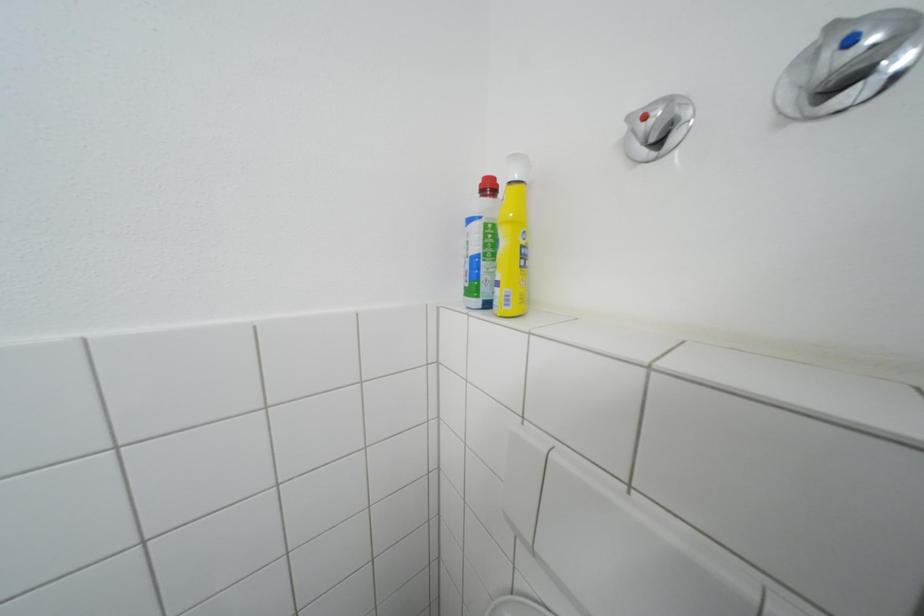
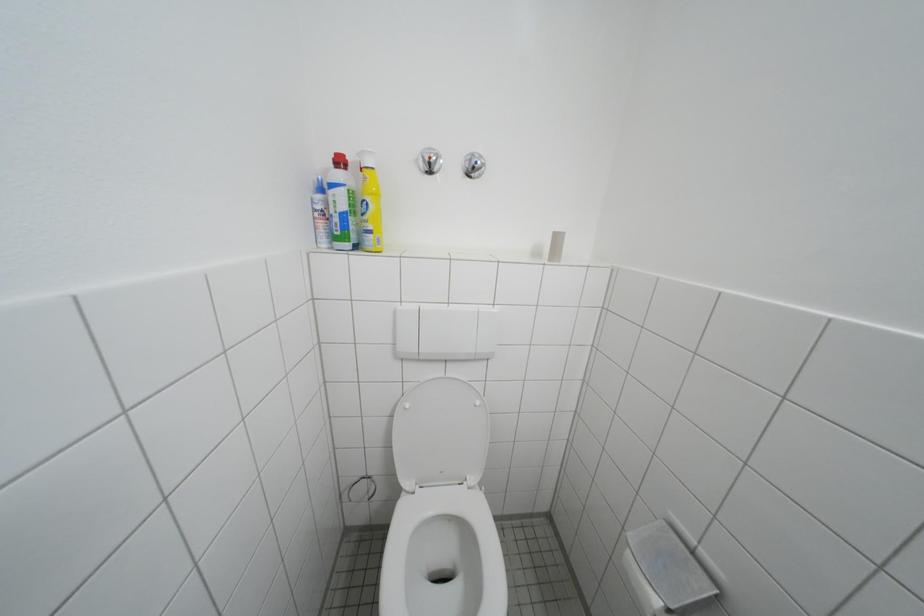
Question: The camera is either moving clockwise (left) or counter-clockwise (right) around the object. The first image is from the beginning of the video and the second image is from the end. Is the camera moving left or right when shooting the video?

Choices:
 (A) Left
 (B) Right

Answer: (A)